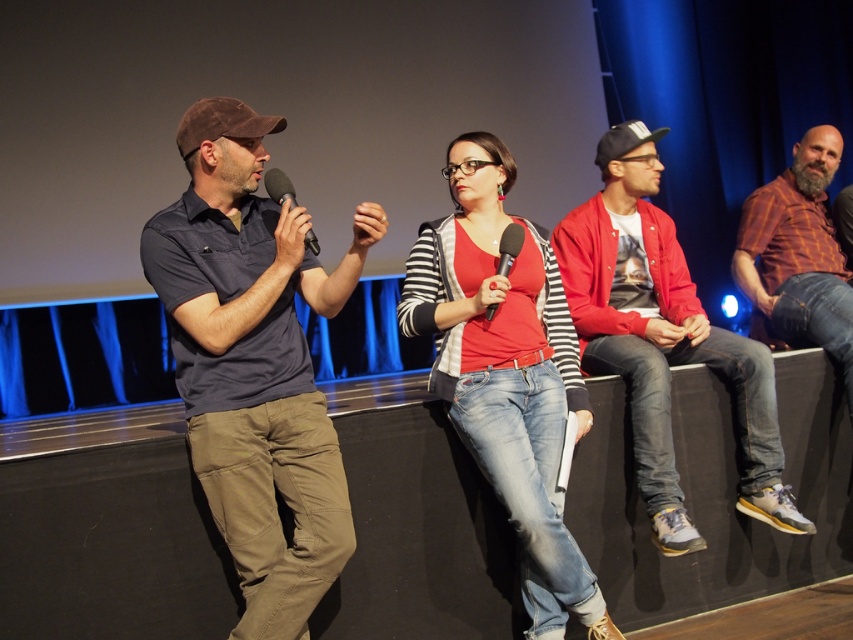
You are an event organizer and need to adjust the microphones for a panel discussion. The scene shows a matte red shirt at center and a black matte microphone at center. Which object is on the right side of the other?

The matte red shirt at center is positioned on the right side of the black matte microphone at center.

In the scene shown: Based on the scene description, where is the matte red shirt at center located in terms of coordinates?

The matte red shirt at center is located at coordinates point (506, 372).

You are an event organizer trying to arrange a photo shoot for the panel discussion. The photographer wants to ensure that the red cotton jacket at right is visible in the frame. Based on its position, where should the photographer focus the camera to capture it?

The photographer should focus the camera on the coordinates point (663, 339) to ensure the red cotton jacket at right is visible in the frame.